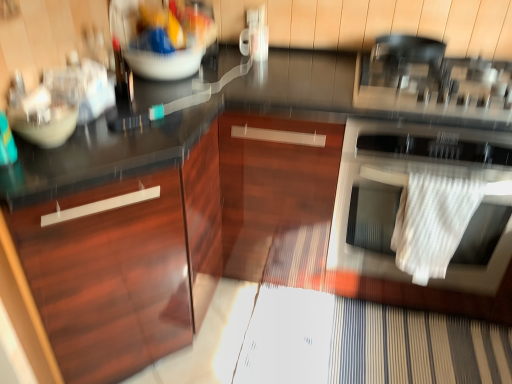
Question: Does white textured towel at right have a larger size compared to matte white bowl at left?

Choices:
 (A) yes
 (B) no

Answer: (A)

Question: Is white textured towel at right surrounding matte white bowl at left?

Choices:
 (A) no
 (B) yes

Answer: (A)

Question: From the image's perspective, is white textured towel at right under matte white bowl at left?

Choices:
 (A) no
 (B) yes

Answer: (B)

Question: Is white textured towel at right wider than matte white bowl at left?

Choices:
 (A) no
 (B) yes

Answer: (B)

Question: Is the position of white textured towel at right more distant than that of matte white bowl at left?

Choices:
 (A) no
 (B) yes

Answer: (B)

Question: Is the position of white textured towel at right less distant than that of matte white bowl at left?

Choices:
 (A) yes
 (B) no

Answer: (B)

Question: Is white textured towel at right inside matte white bowl at left?

Choices:
 (A) yes
 (B) no

Answer: (B)

Question: From a real-world perspective, does matte white bowl at left stand above white textured towel at right?

Choices:
 (A) no
 (B) yes

Answer: (B)

Question: Considering the relative sizes of matte white bowl at left and white textured towel at right in the image provided, is matte white bowl at left thinner than white textured towel at right?

Choices:
 (A) no
 (B) yes

Answer: (B)

Question: Can you confirm if matte white bowl at left is shorter than white textured towel at right?

Choices:
 (A) yes
 (B) no

Answer: (A)

Question: From a real-world perspective, is matte white bowl at left beneath white textured towel at right?

Choices:
 (A) yes
 (B) no

Answer: (B)

Question: Is matte white bowl at left at the right side of white textured towel at right?

Choices:
 (A) no
 (B) yes

Answer: (A)

Question: From the image's perspective, is glossy wood cabinet at left located beneath white textured towel at right?

Choices:
 (A) yes
 (B) no

Answer: (A)